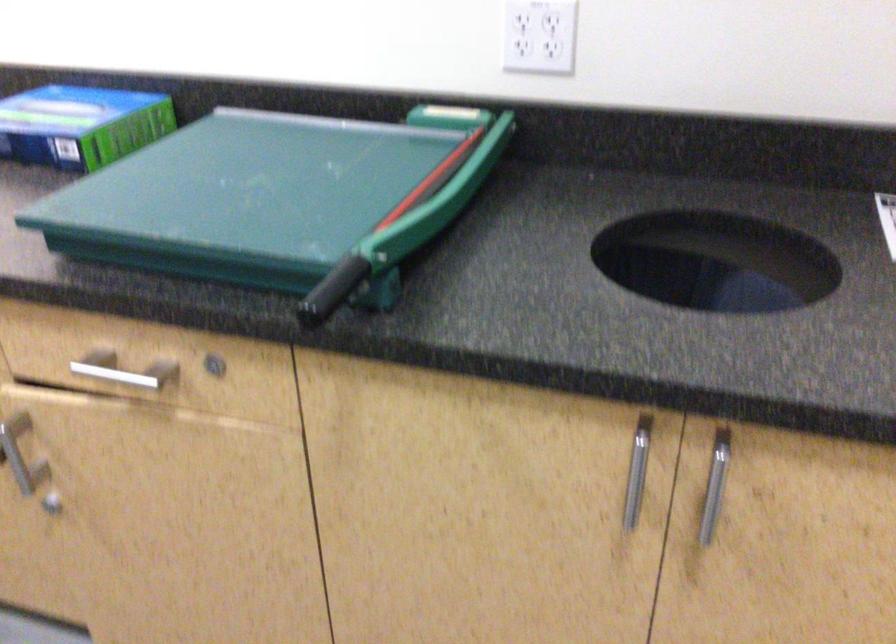
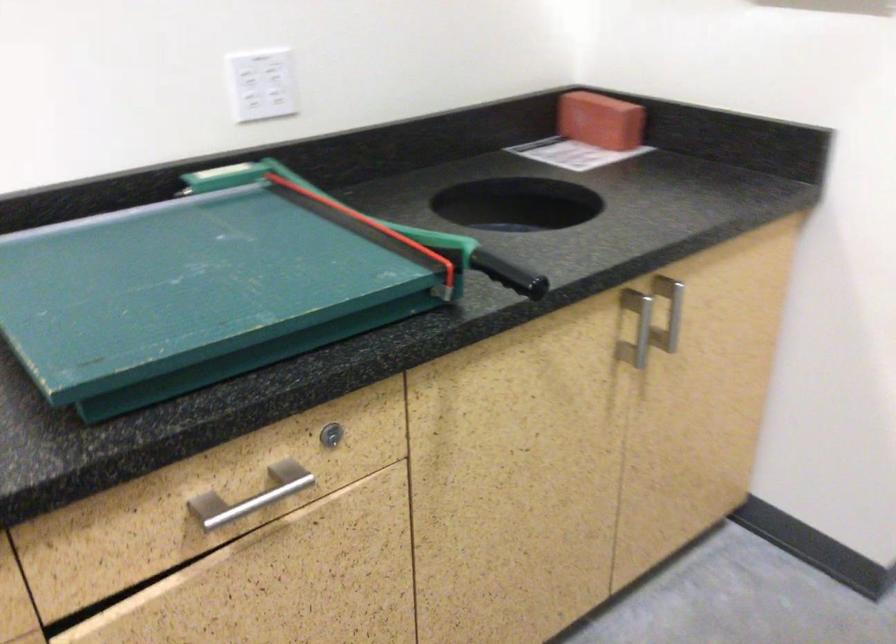
The point at (734, 476) is marked in the first image. Where is the corresponding point in the second image?

(669, 307)